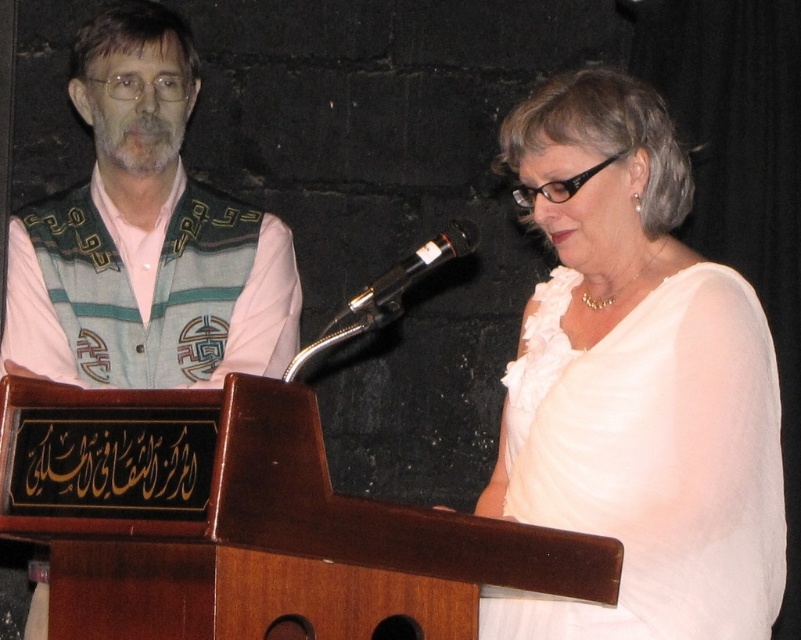
Is white satin blouse at center in front of patterned fabric vest at left?

Yes, white satin blouse at center is in front of patterned fabric vest at left.

Can you confirm if white satin blouse at center is smaller than patterned fabric vest at left?

No.

The image size is (801, 640). I want to click on white satin blouse at center, so click(x=636, y=385).

Where is `white satin blouse at center`? white satin blouse at center is located at coordinates (636, 385).

You are a GUI agent. You are given a task and a screenshot of the screen. Output one action in this format:
    pyautogui.click(x=<x>, y=<y>)
    Task: Click on the patterned fabric vest at left
    The width and height of the screenshot is (801, 640).
    Given the screenshot: What is the action you would take?
    pyautogui.click(x=143, y=236)

Does patterned fabric vest at left appear over black metallic microphone at center?

Correct, patterned fabric vest at left is located above black metallic microphone at center.

Does point (119, 301) come closer to viewer compared to point (379, 308)?

No, it is behind (379, 308).

I want to click on patterned fabric vest at left, so click(x=143, y=236).

What do you see at coordinates (636, 385) in the screenshot? This screenshot has width=801, height=640. I see `white satin blouse at center` at bounding box center [636, 385].

Who is more distant from viewer, [731,532] or [377,280]?

The point [731,532] is behind.

Who is more forward, (747,428) or (376,282)?

Point (376,282)

Where is `white satin blouse at center`? Image resolution: width=801 pixels, height=640 pixels. white satin blouse at center is located at coordinates (636, 385).